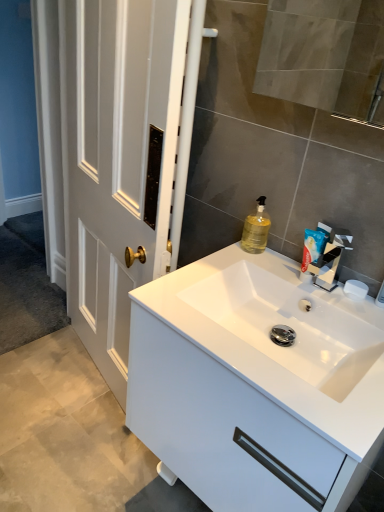
In order to click on free area in between white plastic toothpaste tube at upper right and translucent yellow liquid at sink right in this screenshot , I will do `click(276, 263)`.